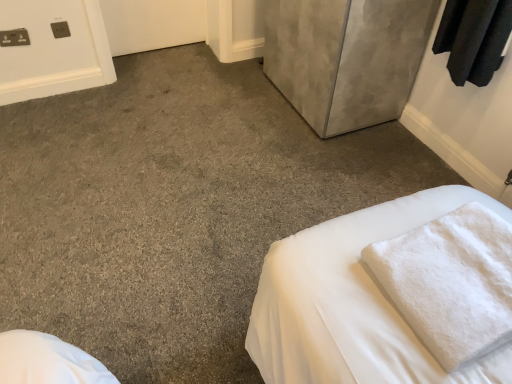
Question: Considering the positions of white fluffy bath towel at lower right and matte gray cabinet at upper right in the image, is white fluffy bath towel at lower right taller or shorter than matte gray cabinet at upper right?

Choices:
 (A) tall
 (B) short

Answer: (B)

Question: Visually, is white fluffy bath towel at lower right positioned to the left or to the right of matte gray cabinet at upper right?

Choices:
 (A) left
 (B) right

Answer: (B)

Question: Is point pos(437,311) closer or farther from the camera than point pos(357,92)?

Choices:
 (A) closer
 (B) farther

Answer: (A)

Question: From the image's perspective, is matte gray cabinet at upper right located above or below white fluffy bath towel at lower right?

Choices:
 (A) above
 (B) below

Answer: (A)

Question: In the image, is matte gray cabinet at upper right positioned in front of or behind white fluffy bath towel at lower right?

Choices:
 (A) front
 (B) behind

Answer: (B)

Question: Looking at the image, does matte gray cabinet at upper right seem bigger or smaller compared to white fluffy bath towel at lower right?

Choices:
 (A) big
 (B) small

Answer: (A)

Question: Is point (346, 66) positioned closer to the camera than point (480, 235)?

Choices:
 (A) closer
 (B) farther

Answer: (B)